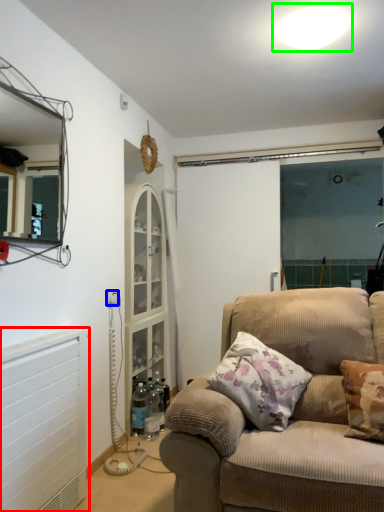
Question: Based on their relative distances, which object is nearer to radiator (highlighted by a red box)? Choose from electric outlet (highlighted by a blue box) and light (highlighted by a green box).

Choices:
 (A) electric outlet
 (B) light

Answer: (A)